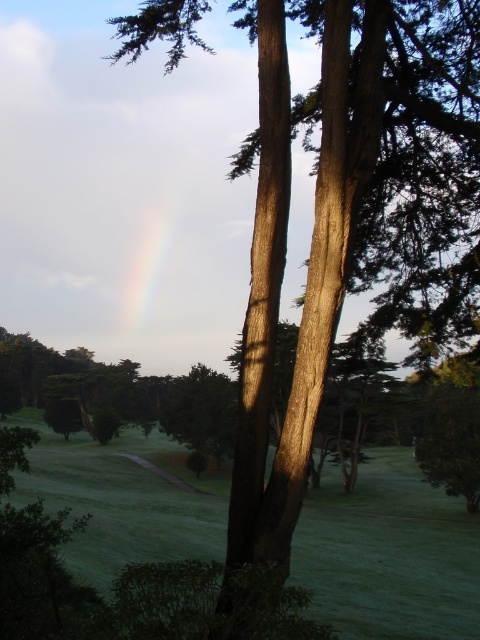
Looking at this image, which is more to the left, green matte tree at center or rainbow translucent at center?

rainbow translucent at center

Which is behind, point (178, 436) or point (156, 209)?

The point (156, 209) is more distant.

Where is `green matte tree at center`? This screenshot has height=640, width=480. green matte tree at center is located at coordinates (202, 412).

Is green grass at center in front of green matte tree at center?

Yes, green grass at center is in front of green matte tree at center.

Who is lower down, green grass at center or green matte tree at center?

green grass at center

This screenshot has height=640, width=480. I want to click on green grass at center, so click(389, 556).

Based on the photo, does green grass at center have a smaller size compared to rainbow translucent at center?

Actually, green grass at center might be larger than rainbow translucent at center.

Between green grass at center and rainbow translucent at center, which one appears on the left side from the viewer's perspective?

rainbow translucent at center is more to the left.

At what (x,y) coordinates should I click in order to perform the action: click on green grass at center. Please return your answer as a coordinate pair (x, y). The height and width of the screenshot is (640, 480). Looking at the image, I should click on (389, 556).